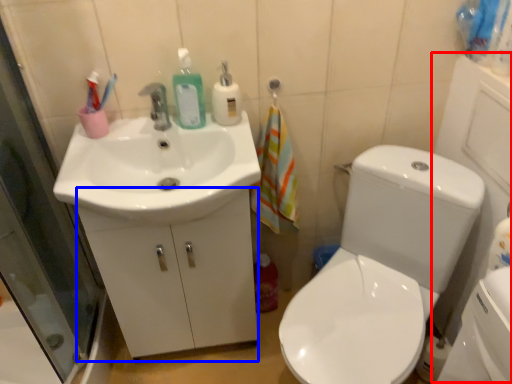
Question: Which object appears farthest to the camera in this image, side (highlighted by a red box) or drawer (highlighted by a blue box)?

Choices:
 (A) side
 (B) drawer

Answer: (B)